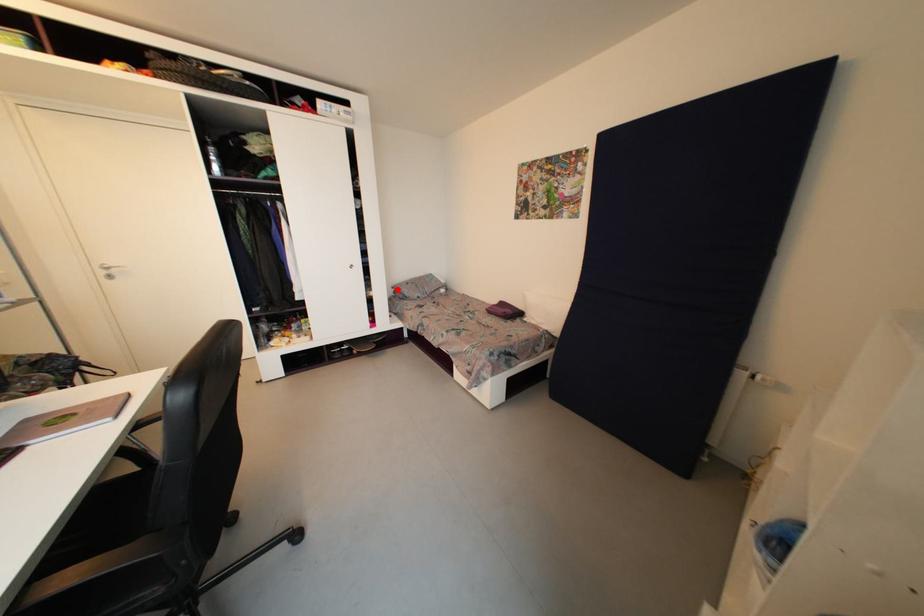
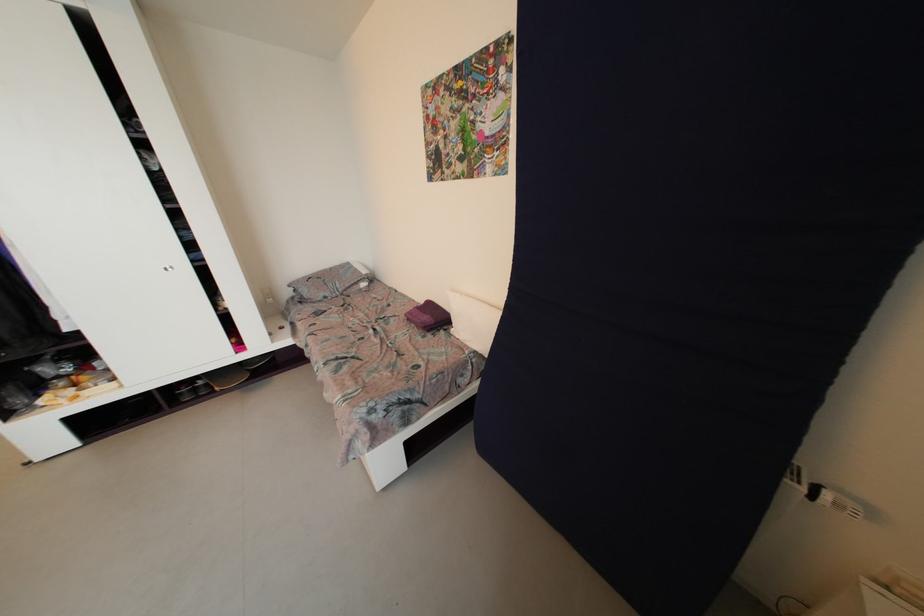
The point at the highlighted location is marked in the first image. Where is the corresponding point in the second image?

(294, 288)